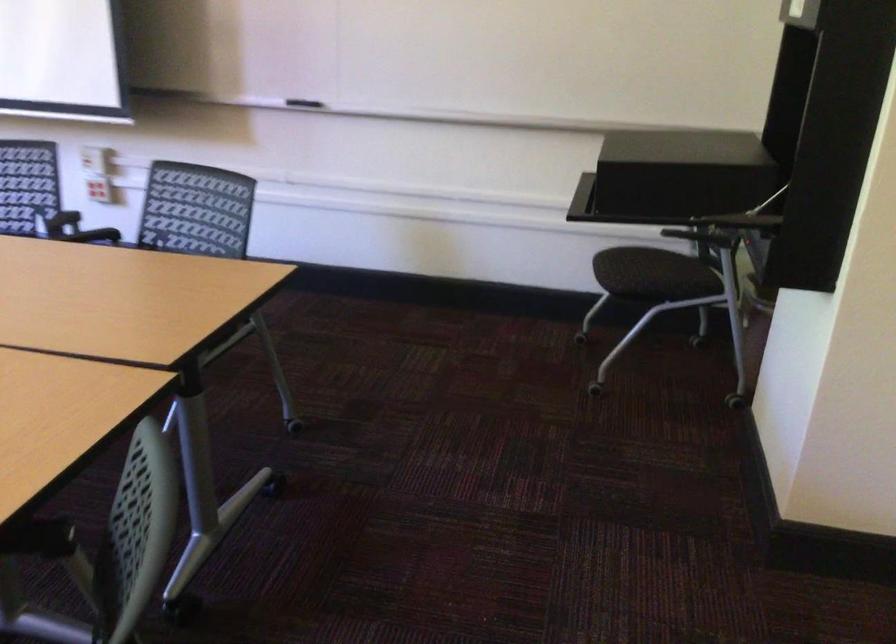
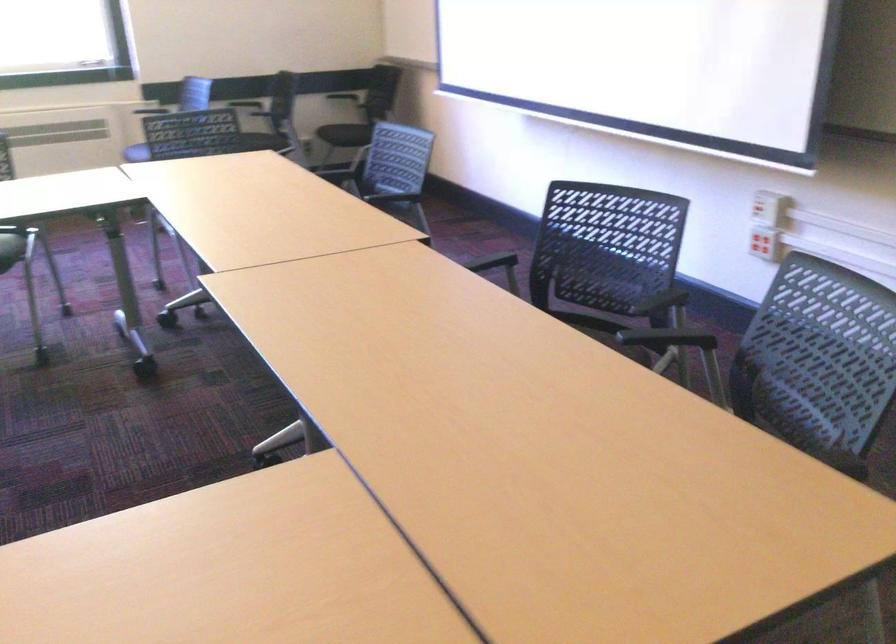
Question: The first image is from the beginning of the video and the second image is from the end. How did the camera likely rotate when shooting the video?

Choices:
 (A) Left
 (B) Right
 (C) Up
 (D) Down

Answer: (A)